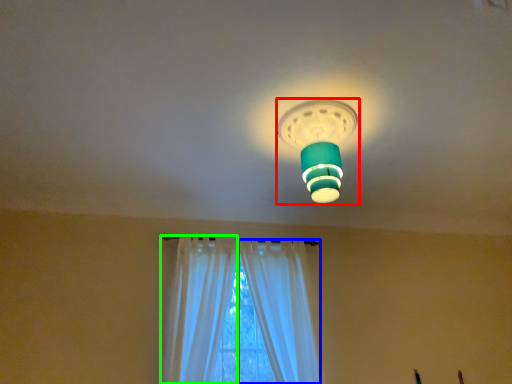
Question: Considering the real-world distances, which object is closest to lamp (highlighted by a red box)? curtain (highlighted by a blue box) or curtain (highlighted by a green box).

Choices:
 (A) curtain
 (B) curtain

Answer: (A)